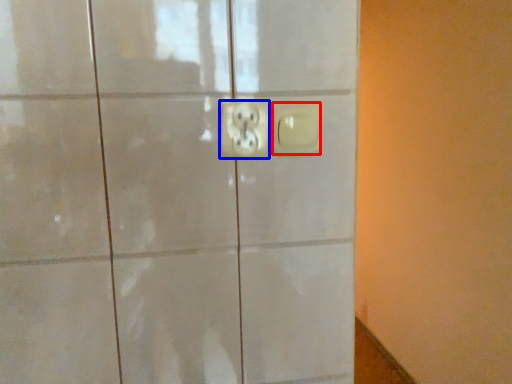
Question: Which point is closer to the camera, light switch (highlighted by a red box) or power plugs and sockets (highlighted by a blue box)?

Choices:
 (A) light switch
 (B) power plugs and sockets

Answer: (B)